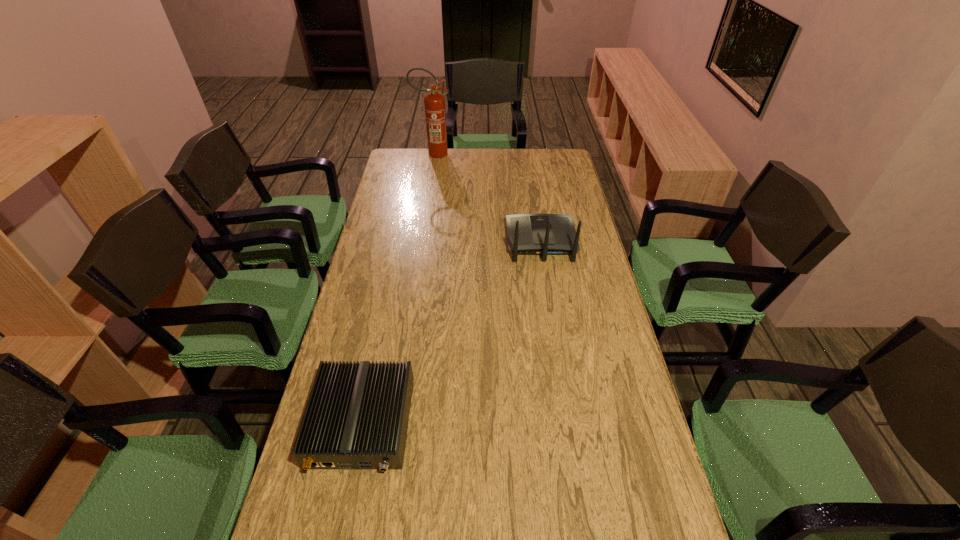
Locate an element on the screen. The width and height of the screenshot is (960, 540). free space that satisfies the following two spatial constraints: 1. from the nozzle of the farthest object; 2. on the back panel of the nearest object is located at coordinates (392, 423).

Identify the location of vacant area in the image that satisfies the following two spatial constraints: 1. from the nozzle of the fire extinguisher; 2. on the back panel of the left router. (392, 423).

Locate an element on the screen. vacant space that satisfies the following two spatial constraints: 1. from the nozzle of the farthest object; 2. on the back panel of the nearer router is located at coordinates (392, 423).

You are a GUI agent. You are given a task and a screenshot of the screen. Output one action in this format:
    pyautogui.click(x=<x>, y=<y>)
    Task: Click on the vacant area that satisfies the following two spatial constraints: 1. from the nozzle of the fire extinguisher; 2. on the back panel of the nearest object
    The height and width of the screenshot is (540, 960).
    Given the screenshot: What is the action you would take?
    pyautogui.click(x=392, y=423)

I want to click on vacant space that satisfies the following two spatial constraints: 1. from the nozzle of the tallest object; 2. on the front-facing side of the farther router, so click(x=420, y=241).